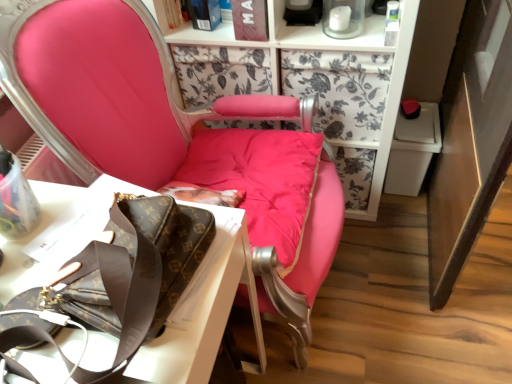
Question: Is point (155, 157) closer or farther from the camera than point (62, 213)?

Choices:
 (A) farther
 (B) closer

Answer: (A)

Question: From a real-world perspective, is matte pink cushion at center physically located above or below white paper at upper left?

Choices:
 (A) above
 (B) below

Answer: (A)

Question: Is matte pink cushion at center spatially inside white paper at upper left, or outside of it?

Choices:
 (A) outside
 (B) inside

Answer: (A)

Question: Considering the positions of white paper at upper left and matte pink cushion at center in the image, is white paper at upper left bigger or smaller than matte pink cushion at center?

Choices:
 (A) small
 (B) big

Answer: (A)

Question: From a real-world perspective, relative to matte pink cushion at center, is white paper at upper left vertically above or below?

Choices:
 (A) above
 (B) below

Answer: (B)

Question: Relative to matte pink cushion at center, is white paper at upper left in front or behind?

Choices:
 (A) front
 (B) behind

Answer: (B)

Question: From the image's perspective, is white paper at upper left positioned above or below matte pink cushion at center?

Choices:
 (A) below
 (B) above

Answer: (A)